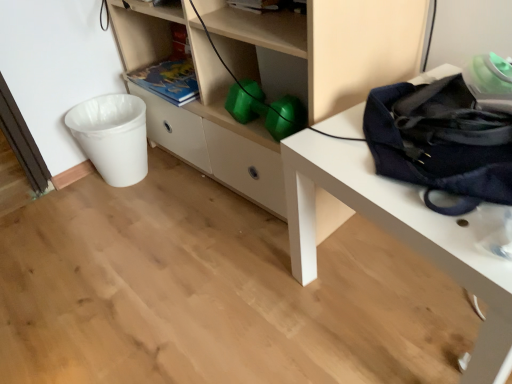
Question: Is matte white shelf at center not within white plastic trash can at left?

Choices:
 (A) no
 (B) yes

Answer: (B)

Question: From the image's perspective, is matte white shelf at center located above white plastic trash can at left?

Choices:
 (A) no
 (B) yes

Answer: (B)

Question: Considering the relative positions of matte white shelf at center and white plastic trash can at left in the image provided, is matte white shelf at center to the left of white plastic trash can at left from the viewer's perspective?

Choices:
 (A) yes
 (B) no

Answer: (B)

Question: Is the depth of matte white shelf at center greater than that of white plastic trash can at left?

Choices:
 (A) no
 (B) yes

Answer: (A)

Question: Is matte white shelf at center positioned far away from white plastic trash can at left?

Choices:
 (A) yes
 (B) no

Answer: (B)

Question: In terms of size, does navy blue fabric messenger bag at right appear bigger or smaller than matte white shelf at center?

Choices:
 (A) big
 (B) small

Answer: (B)

Question: In the image, is navy blue fabric messenger bag at right on the left side or the right side of matte white shelf at center?

Choices:
 (A) right
 (B) left

Answer: (A)

Question: In terms of width, does navy blue fabric messenger bag at right look wider or thinner when compared to matte white shelf at center?

Choices:
 (A) wide
 (B) thin

Answer: (B)

Question: From their relative heights in the image, would you say navy blue fabric messenger bag at right is taller or shorter than matte white shelf at center?

Choices:
 (A) tall
 (B) short

Answer: (B)

Question: From a real-world perspective, is navy blue fabric messenger bag at right above or below matte green book at center?

Choices:
 (A) above
 (B) below

Answer: (A)

Question: In terms of size, does navy blue fabric messenger bag at right appear bigger or smaller than matte green book at center?

Choices:
 (A) small
 (B) big

Answer: (B)

Question: Which is correct: navy blue fabric messenger bag at right is inside matte green book at center, or outside of it?

Choices:
 (A) outside
 (B) inside

Answer: (A)

Question: Relative to matte green book at center, is navy blue fabric messenger bag at right in front or behind?

Choices:
 (A) front
 (B) behind

Answer: (A)

Question: Considering the positions of navy blue fabric bag at right and navy blue fabric messenger bag at right in the image, is navy blue fabric bag at right bigger or smaller than navy blue fabric messenger bag at right?

Choices:
 (A) small
 (B) big

Answer: (B)

Question: Do you think navy blue fabric bag at right is within navy blue fabric messenger bag at right, or outside of it?

Choices:
 (A) outside
 (B) inside

Answer: (A)